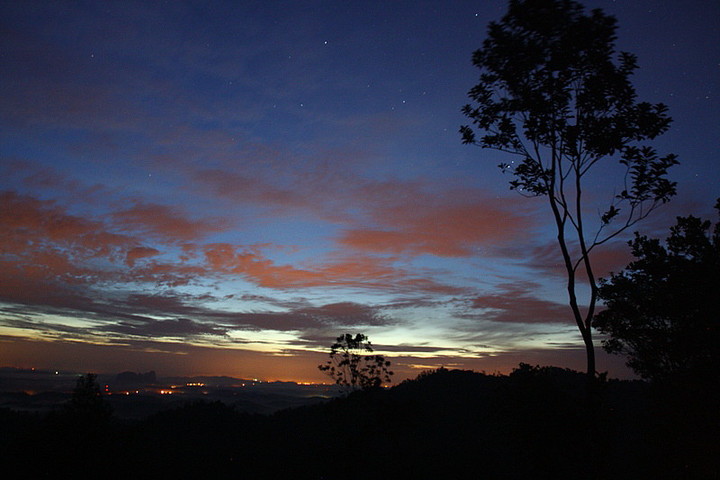
Locate an element on the screen. The width and height of the screenshot is (720, 480). lights is located at coordinates (166, 393), (189, 383).